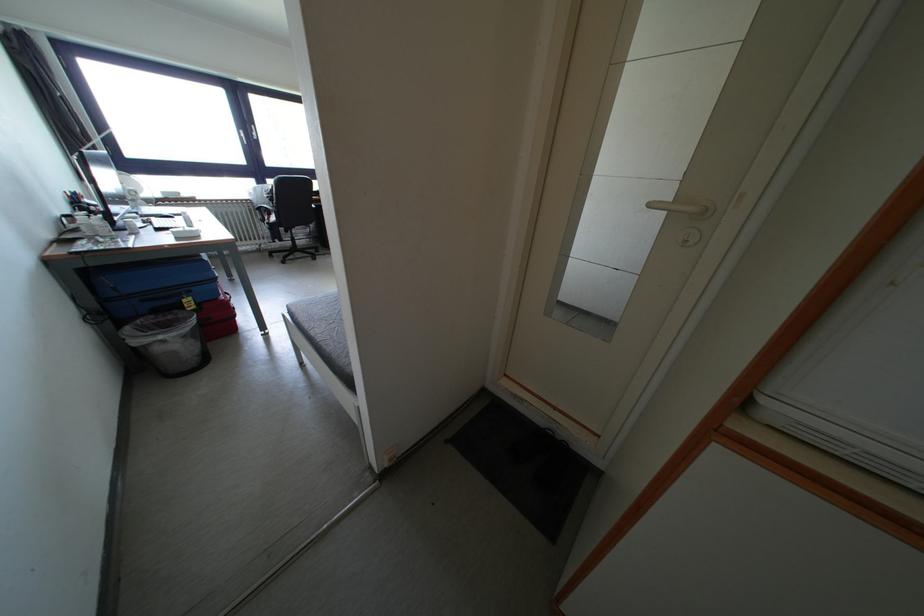
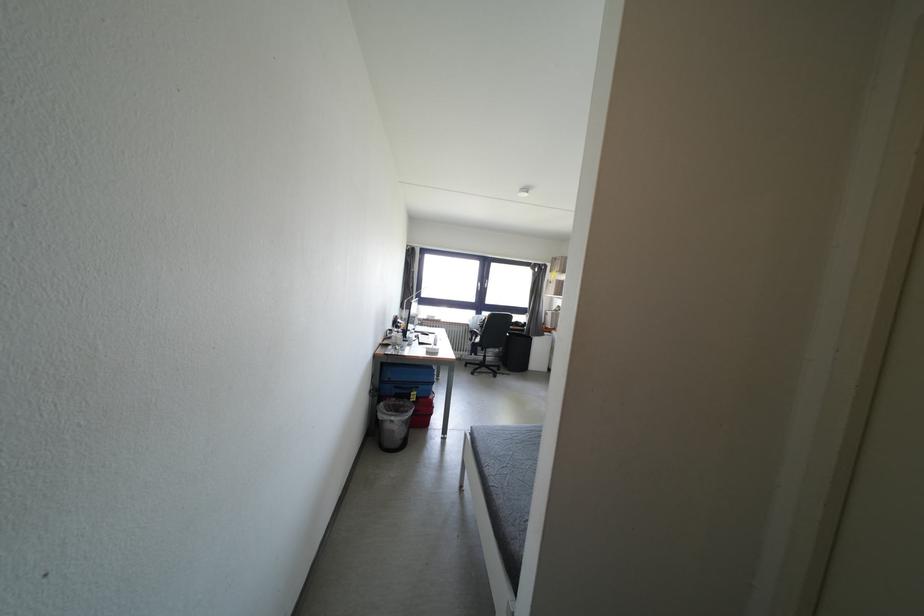
The first image is from the beginning of the video and the second image is from the end. How did the camera likely rotate when shooting the video?

The camera's rotation is toward left-up.